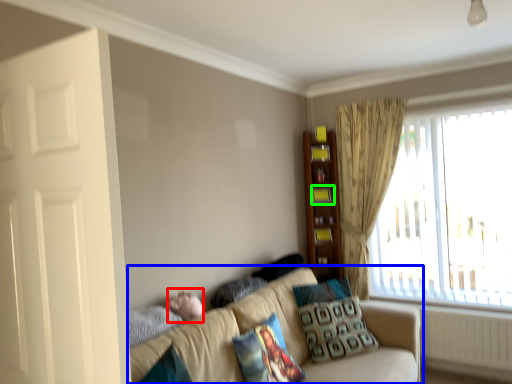
Question: Based on their relative distances, which object is nearer to baby (highlighted by a red box)? Choose from studio couch (highlighted by a blue box) and shelf (highlighted by a green box).

Choices:
 (A) studio couch
 (B) shelf

Answer: (A)